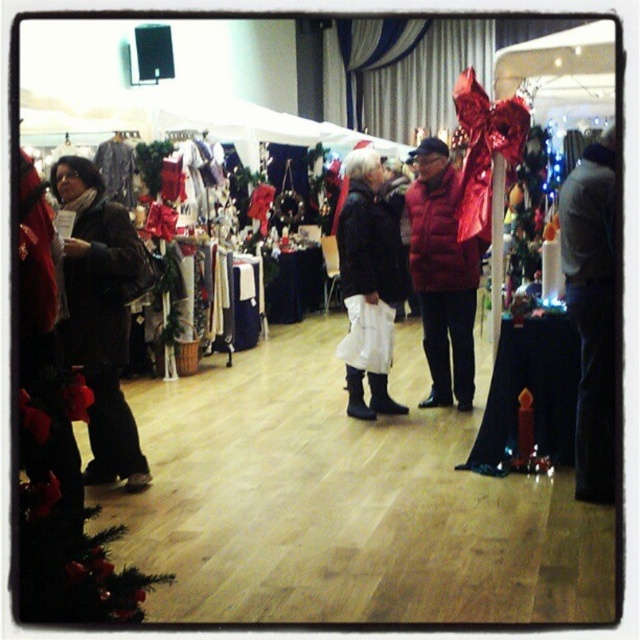
Question: Based on their relative distances, which object is nearer to the red down jacket at center?

Choices:
 (A) matte black boots at center
 (B) matte black jacket at left

Answer: (A)

Question: Among these points, which one is farthest from the camera?

Choices:
 (A) (410, 221)
 (B) (68, 321)
 (C) (371, 371)

Answer: (A)

Question: Considering the relative positions of red down jacket at center and matte black boots at center in the image provided, where is red down jacket at center located with respect to matte black boots at center?

Choices:
 (A) right
 (B) left

Answer: (A)

Question: In this image, where is red down jacket at center located relative to matte black boots at center?

Choices:
 (A) below
 (B) above

Answer: (B)

Question: Can you confirm if red down jacket at center is thinner than matte black boots at center?

Choices:
 (A) yes
 (B) no

Answer: (A)

Question: Which point is closer to the camera?

Choices:
 (A) red down jacket at center
 (B) matte black jacket at left

Answer: (B)